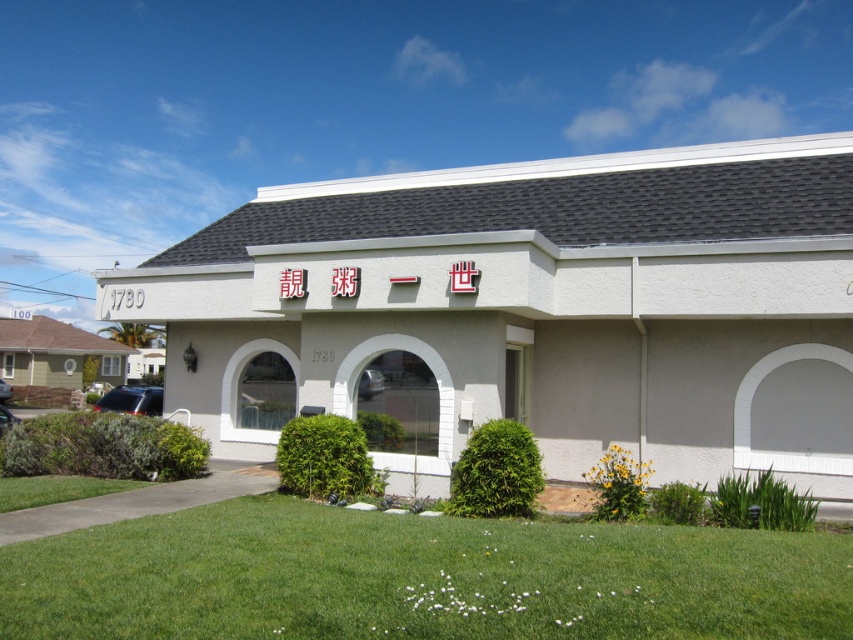
You are standing in front of the white stucco building at center. There are two small rounded shrubs on either side of the lawn. How far apart are the two shrubs from each other?

The two small rounded shrubs are 9.03 meters apart from each other.

You are a landscape architect designing a garden for the white stucco building at center. The green grass at lower center needs to be maintained. Considering the size difference between the two, which area requires more space for maintenance equipment?

The white stucco building at center requires more space for maintenance equipment because its width is larger than the green grass at lower center.

You are standing in front of the white stucco building at center and the green grass at lower center. Which object is positioned higher from the ground?

The white stucco building at center is located above green grass at lower center, so it is positioned higher from the ground.